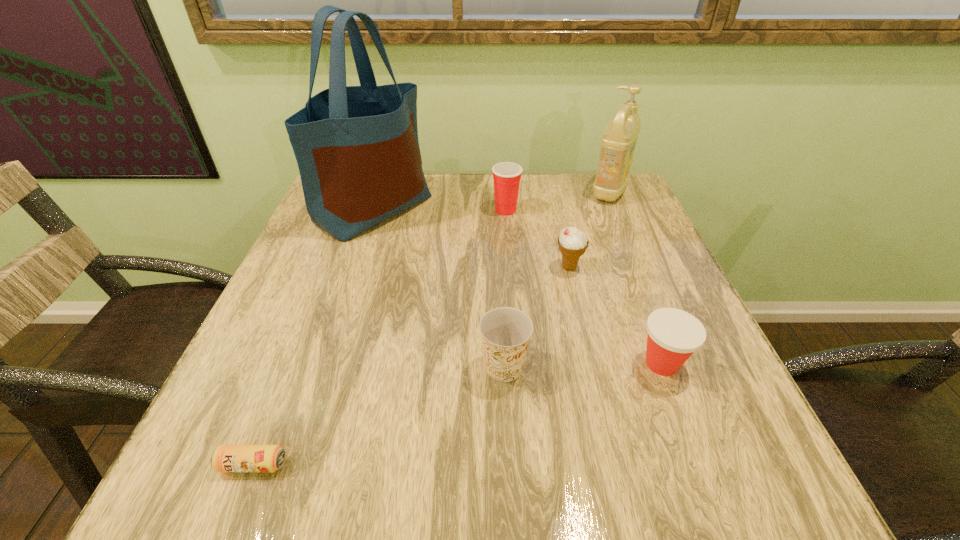
Locate an element on the screen. detergent at the right edge is located at coordinates [618, 142].

Where is `Dixie cup at the right edge`? Dixie cup at the right edge is located at coordinates (673, 335).

In order to click on object that is at the far left corner in this screenshot , I will do `click(357, 149)`.

The image size is (960, 540). I want to click on object at the near left corner, so click(x=226, y=458).

Where is `object located at the far right corner`? This screenshot has width=960, height=540. object located at the far right corner is located at coordinates (618, 142).

At what (x,y) coordinates should I click in order to perform the action: click on blank area at the far edge. Please return your answer as a coordinate pair (x, y). This screenshot has height=540, width=960. Looking at the image, I should click on (534, 194).

In the image, there is a desktop. What are the coordinates of `vacant region at the near edge` in the screenshot? It's located at (384, 456).

I want to click on vacant region at the left edge of the desktop, so click(x=306, y=281).

The height and width of the screenshot is (540, 960). I want to click on vacant area at the right edge, so click(x=692, y=395).

In the image, there is a desktop. Identify the location of vacant region at the near left corner. click(x=194, y=456).